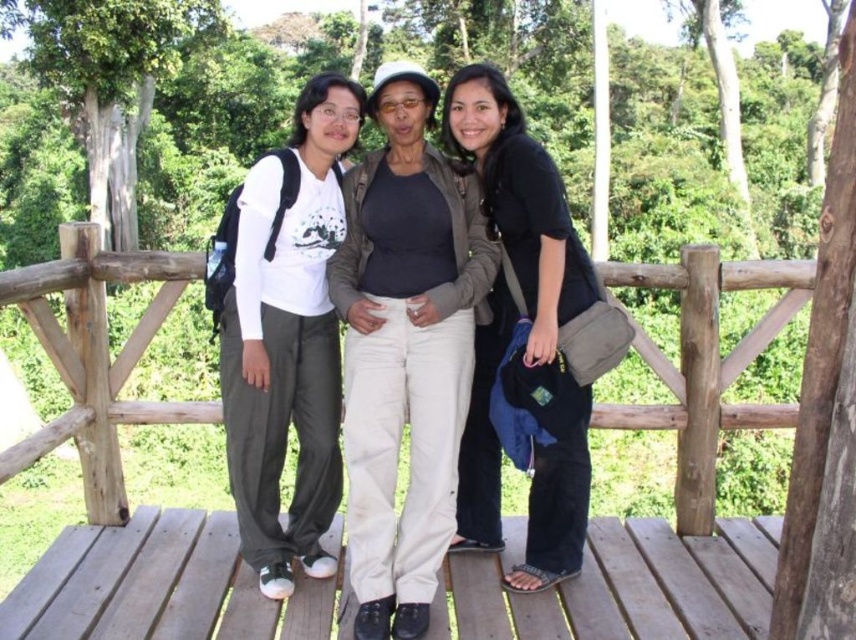
You are trying to determine the clothing sizes of the people in the image. Based on the scene, which clothing item has a larger size between the light beige pants at center and the matte white shirt at center?

The light beige pants at center has a larger size compared to the matte white shirt at center.

You are standing on the wooden deck at center and want to cross to the other side. Is the wooden bridge at center accessible from your current position?

The wooden bridge at center is located above the wooden deck at center, so yes, the wooden bridge at center is accessible from your current position on the wooden deck at center.